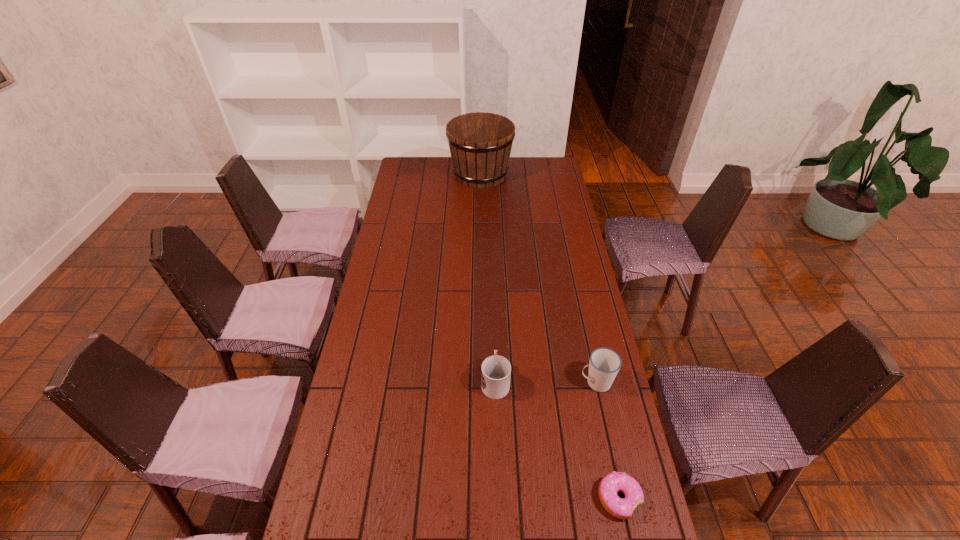
What are the coordinates of `object that is the third closest to the right cup` in the screenshot? It's located at (480, 143).

Choose which object is the third nearest neighbor to the nearest object. Please provide its 2D coordinates. Your answer should be formatted as a tuple, i.e. [(x, y)], where the tuple contains the x and y coordinates of a point satisfying the conditions above.

[(480, 143)]

Where is `vacant position in the image that satisfies the following two spatial constraints: 1. with a handle on the side of the right cup; 2. on the front side of the nearest object`? The image size is (960, 540). vacant position in the image that satisfies the following two spatial constraints: 1. with a handle on the side of the right cup; 2. on the front side of the nearest object is located at coordinates (621, 498).